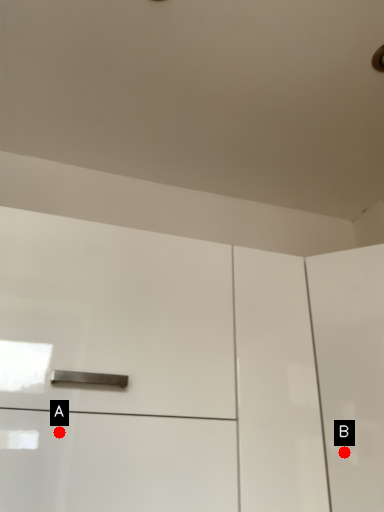
Question: Two points are circled on the image, labeled by A and B beside each circle. Which of the following is the closest to the observer?

Choices:
 (A) A is closer
 (B) B is closer

Answer: (A)